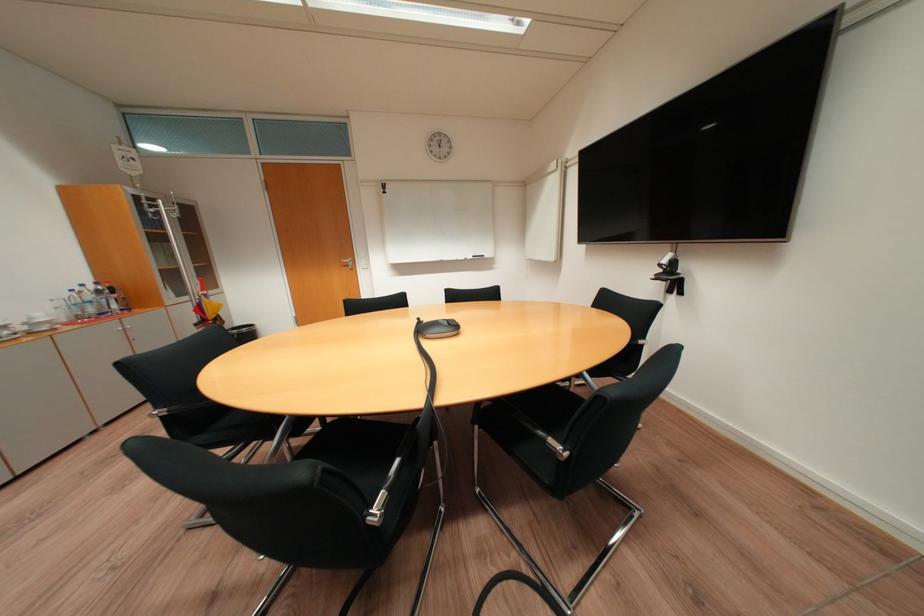
What do you see at coordinates (242, 333) in the screenshot? I see `the black trash can` at bounding box center [242, 333].